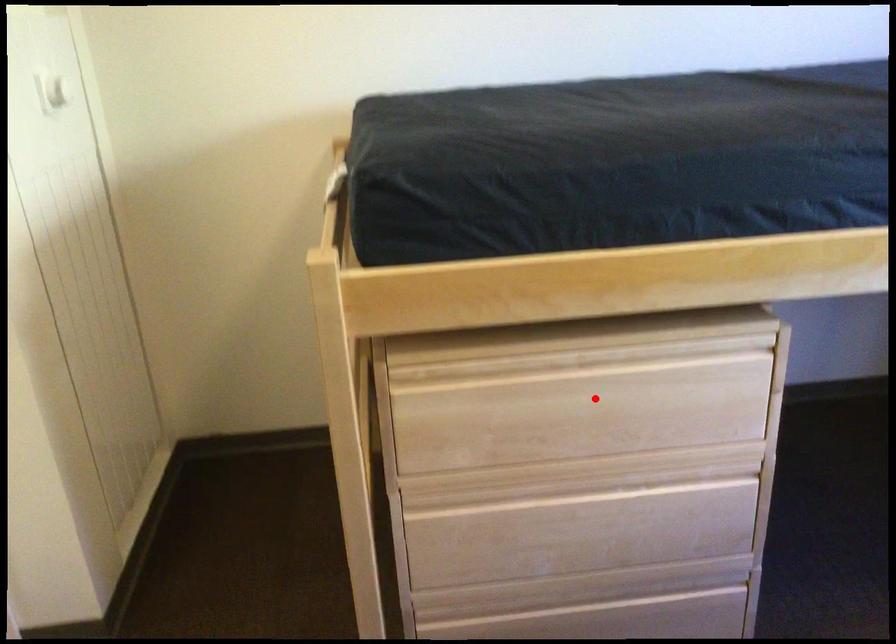
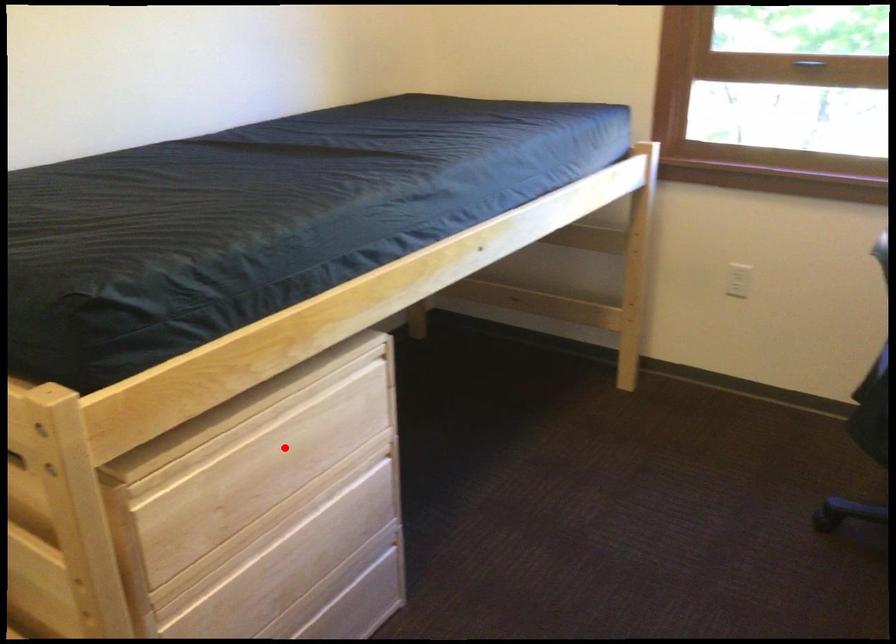
I am providing you with two images of the same scene from different viewpoints. A red point is marked on the first image and another point is marked on the second image. Does the point marked in image1 correspond to the same location as the one in image2?

Yes